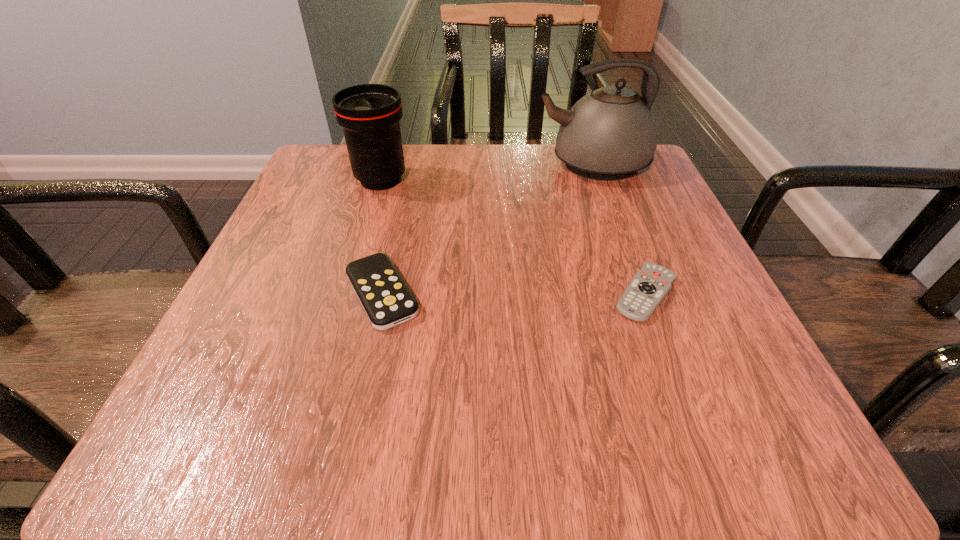
The image size is (960, 540). In order to click on free space located 0.160m on the right of the second shortest object in this screenshot , I will do `click(526, 294)`.

Locate an element on the screen. The width and height of the screenshot is (960, 540). free space located on the front of the shortest object is located at coordinates (697, 429).

At what (x,y) coordinates should I click in order to perform the action: click on kettle present at the far edge. Please return your answer as a coordinate pair (x, y). Image resolution: width=960 pixels, height=540 pixels. Looking at the image, I should click on (609, 134).

The image size is (960, 540). What are the coordinates of `telephoto lens located in the far edge section of the desktop` in the screenshot? It's located at (369, 113).

The height and width of the screenshot is (540, 960). In order to click on telephoto lens located at the left edge in this screenshot , I will do `click(369, 113)`.

Find the location of `remote control that is positioned at the left edge`. remote control that is positioned at the left edge is located at coordinates (386, 299).

Where is `kettle that is at the right edge`? kettle that is at the right edge is located at coordinates (609, 134).

Where is `remote control located at the right edge`? The width and height of the screenshot is (960, 540). remote control located at the right edge is located at coordinates (649, 286).

The image size is (960, 540). Identify the location of object that is at the far left corner. (369, 113).

Identify the location of object that is at the far right corner. The height and width of the screenshot is (540, 960). (609, 134).